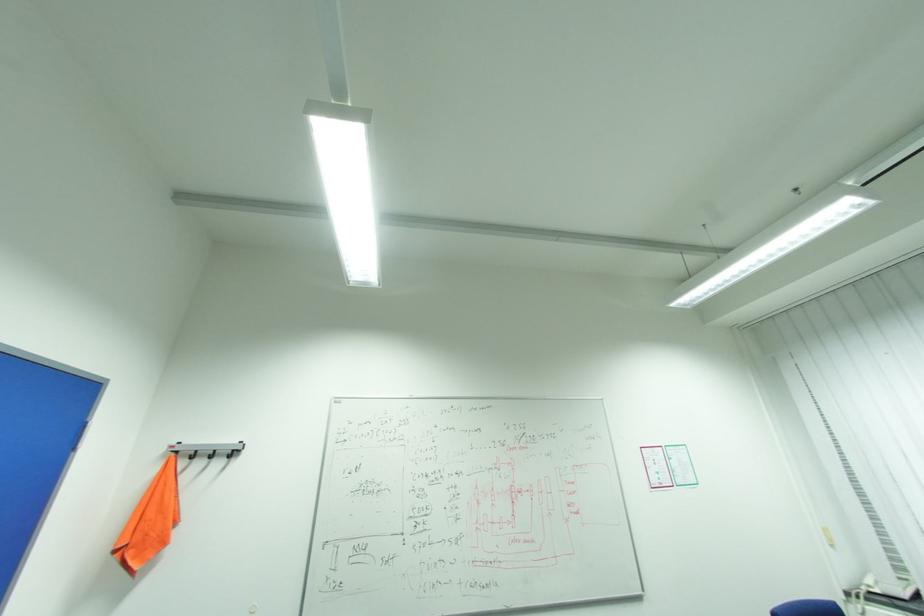
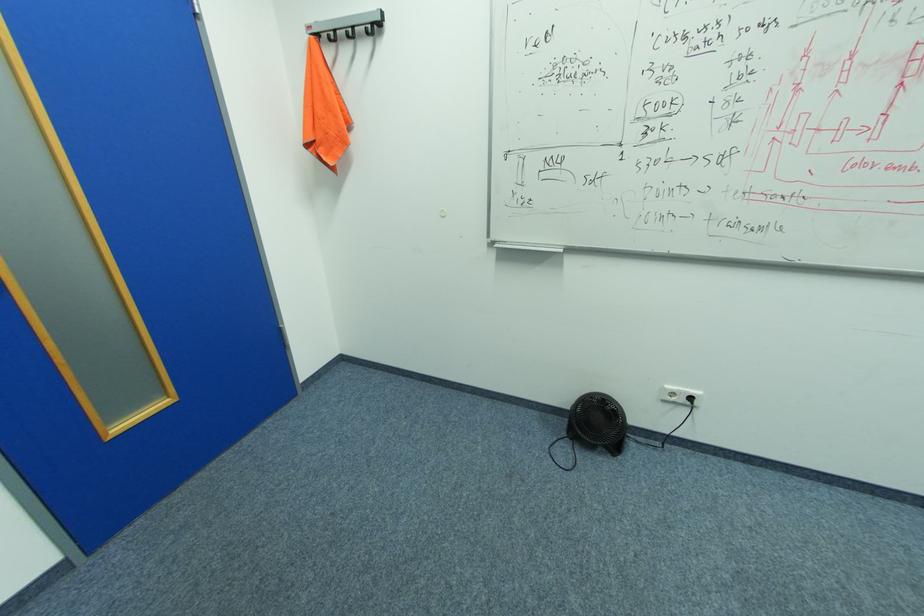
The point at (239, 450) is marked in the first image. Where is the corresponding point in the second image?

(379, 23)